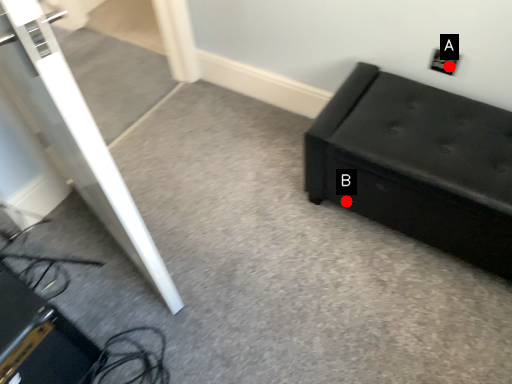
Question: Two points are circled on the image, labeled by A and B beside each circle. Which point is closer to the camera?

Choices:
 (A) A is closer
 (B) B is closer

Answer: (A)